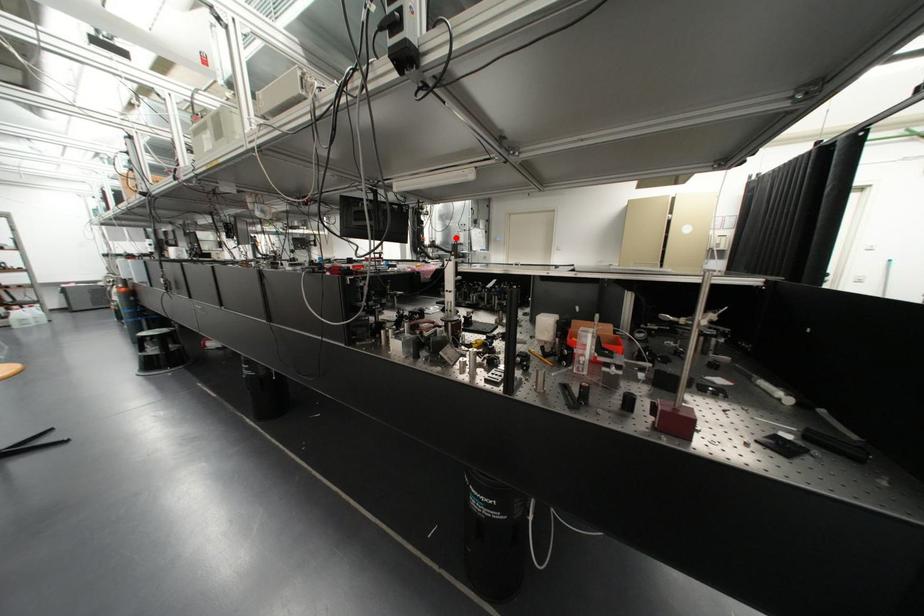
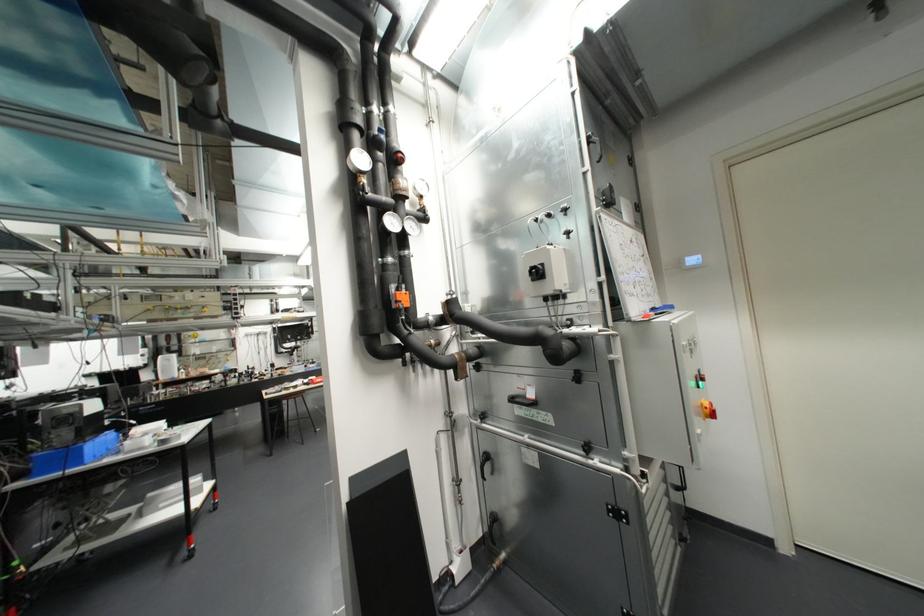
The point at the highlighted location is marked in the first image. Where is the corresponding point in the second image?

(537, 273)